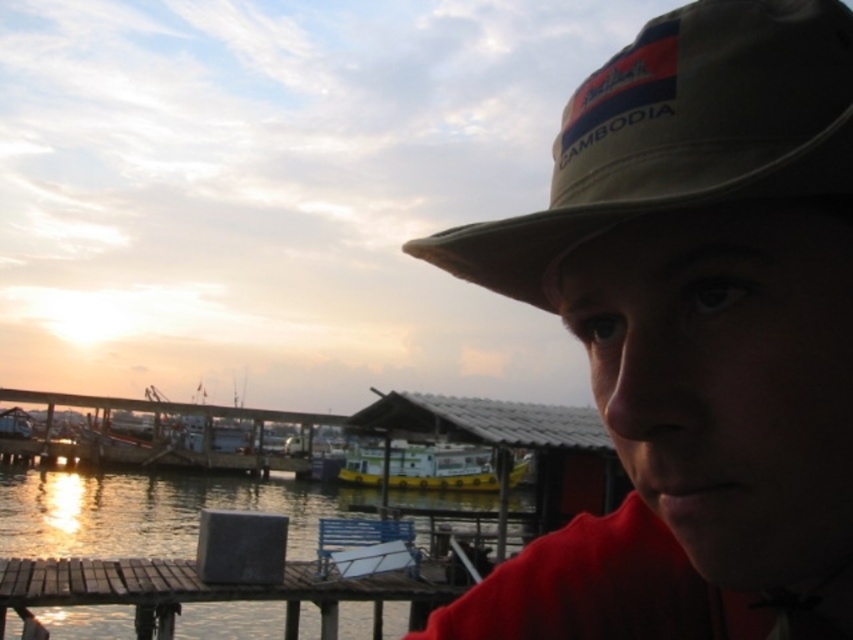
Question: Which point appears farthest from the camera in this image?

Choices:
 (A) (312, 568)
 (B) (515, 472)
 (C) (640, 557)
 (D) (189, 520)

Answer: (B)

Question: Is tan/cotton baseball hat at upper right to the left of brown wooden dock at lower left from the viewer's perspective?

Choices:
 (A) no
 (B) yes

Answer: (A)

Question: Is tan/cotton baseball hat at upper right positioned behind glossy water at dock center?

Choices:
 (A) yes
 (B) no

Answer: (B)

Question: Which point is closer to the camera?

Choices:
 (A) glossy water at dock center
 (B) tan canvas hat at upper right
 (C) brown wooden dock at lower left

Answer: (B)

Question: Does tan canvas hat at upper right have a smaller size compared to brown wooden dock at lower left?

Choices:
 (A) no
 (B) yes

Answer: (B)

Question: Which point is closer to the camera?

Choices:
 (A) tan canvas hat at upper right
 (B) glossy water at dock center

Answer: (A)